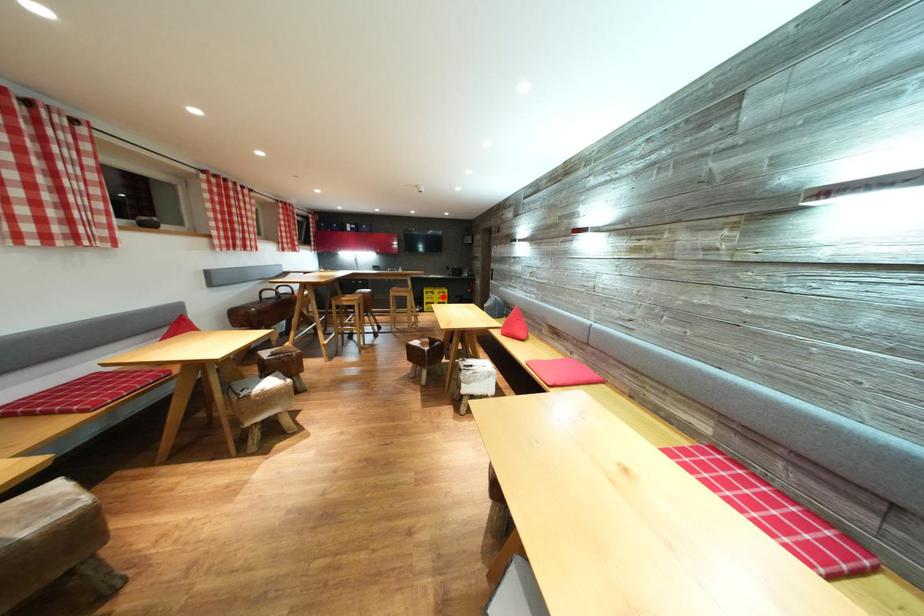
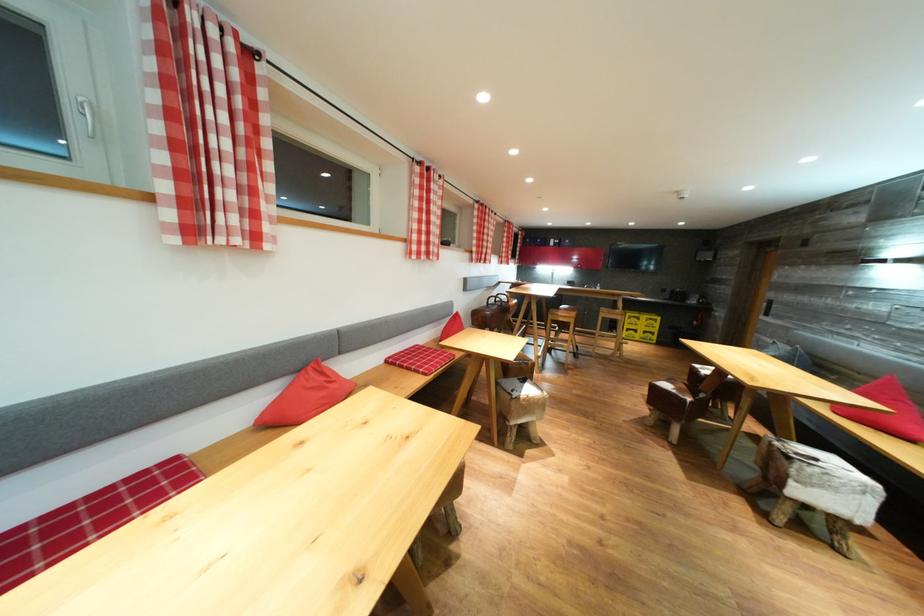
Where in the second image is the point corresponding to the highlighted location from the first image?

(650, 323)